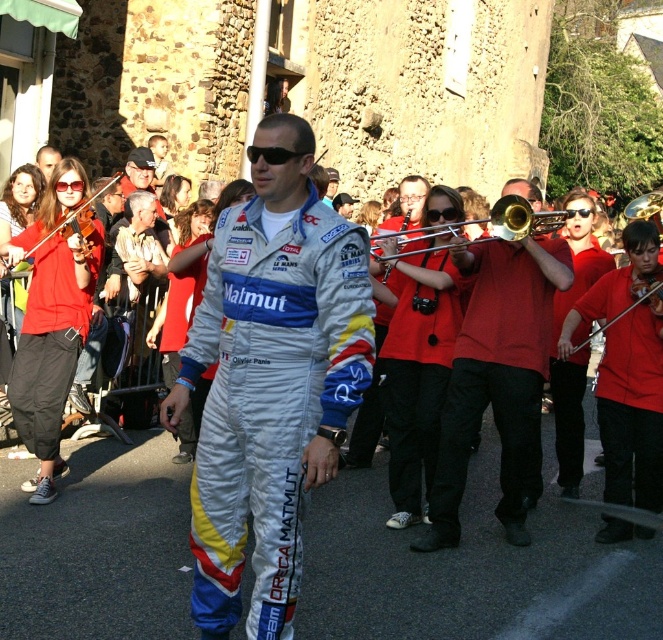
Question: Which point is closer to the camera?

Choices:
 (A) red fabric trombone at center
 (B) white fabric racing suit at center

Answer: (B)

Question: Based on their relative distances, which object is farther from the gold brass trumpet at upper right?

Choices:
 (A) matte black violin at left
 (B) white fabric racing suit at center

Answer: (A)

Question: From the image, what is the correct spatial relationship of white fabric racing suit at center in relation to gold brass trumpet at center?

Choices:
 (A) above
 (B) below

Answer: (B)

Question: Is red fabric trombone at center below gold brass trumpet at upper right?

Choices:
 (A) no
 (B) yes

Answer: (B)

Question: Where is red fabric trombone at center located in relation to gold brass trumpet at upper right in the image?

Choices:
 (A) left
 (B) right

Answer: (A)

Question: Which object is positioned farthest from the red fabric trombone at center?

Choices:
 (A) white fabric racing suit at center
 (B) gold brass trumpet at upper right

Answer: (B)